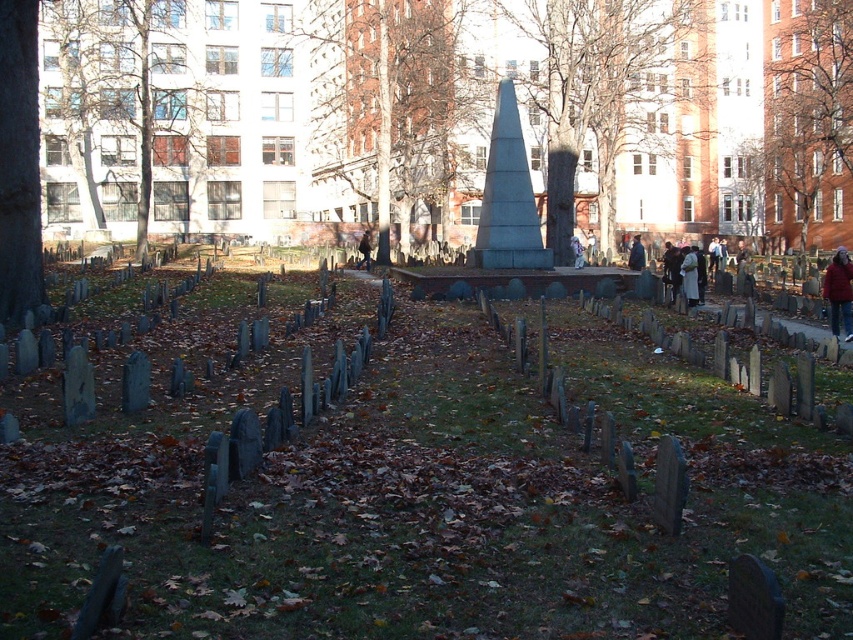
Question: Does wooden gravestones at center come behind granite obelisk at center?

Choices:
 (A) no
 (B) yes

Answer: (A)

Question: Which object is positioned farthest from the white cotton jacket at center?

Choices:
 (A) wooden gravestones at center
 (B) brown leather jacket at center

Answer: (A)

Question: Considering the real-world distances, which object is closest to the granite obelisk at center?

Choices:
 (A) wooden gravestones at center
 (B) blue fabric jacket at center
 (C) brown leather jacket at center

Answer: (B)

Question: Which object is positioned farthest from the white cotton jacket at center?

Choices:
 (A) wooden gravestones at center
 (B) blue fabric jacket at center
 (C) granite obelisk at center

Answer: (A)

Question: Is the position of granite obelisk at center more distant than that of blue fabric jacket at center?

Choices:
 (A) yes
 (B) no

Answer: (B)

Question: From the image, what is the correct spatial relationship of granite obelisk at center in relation to brown leather jacket at center?

Choices:
 (A) left
 (B) right

Answer: (B)